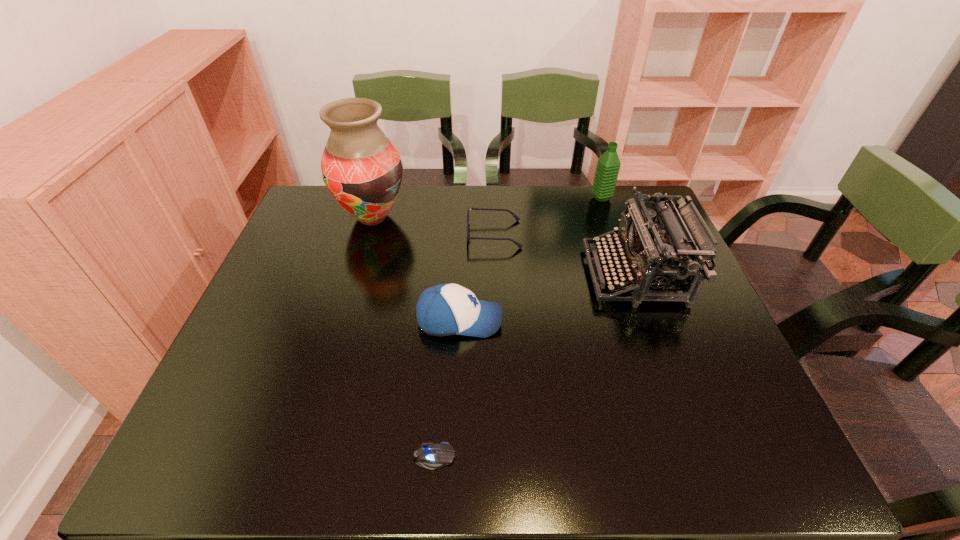
The width and height of the screenshot is (960, 540). Find the location of `vacant area at the right edge`. vacant area at the right edge is located at coordinates (686, 335).

In the image, there is a desktop. What are the coordinates of `free space at the far left corner` in the screenshot? It's located at (317, 220).

Image resolution: width=960 pixels, height=540 pixels. What are the coordinates of `free space at the near left corner` in the screenshot? It's located at 235,460.

Locate an element on the screen. This screenshot has height=540, width=960. blank space at the near right corner of the desktop is located at coordinates (731, 431).

Locate an element on the screen. This screenshot has height=540, width=960. empty space that is in between the nearest object and the water bottle is located at coordinates (517, 327).

Locate an element on the screen. This screenshot has height=540, width=960. free space between the typewriter and the nearest object is located at coordinates (534, 366).

Locate an element on the screen. This screenshot has width=960, height=540. free space between the shortest object and the water bottle is located at coordinates (517, 327).

At what (x,y) coordinates should I click in order to perform the action: click on empty space between the spectacles and the tallest object. Please return your answer as a coordinate pair (x, y). The height and width of the screenshot is (540, 960). Looking at the image, I should click on (433, 226).

What are the coordinates of `vacant area that lies between the spectacles and the water bottle` in the screenshot? It's located at (548, 216).

At what (x,y) coordinates should I click in order to perform the action: click on free space between the leftmost object and the typewriter. Please return your answer as a coordinate pair (x, y). Looking at the image, I should click on (503, 246).